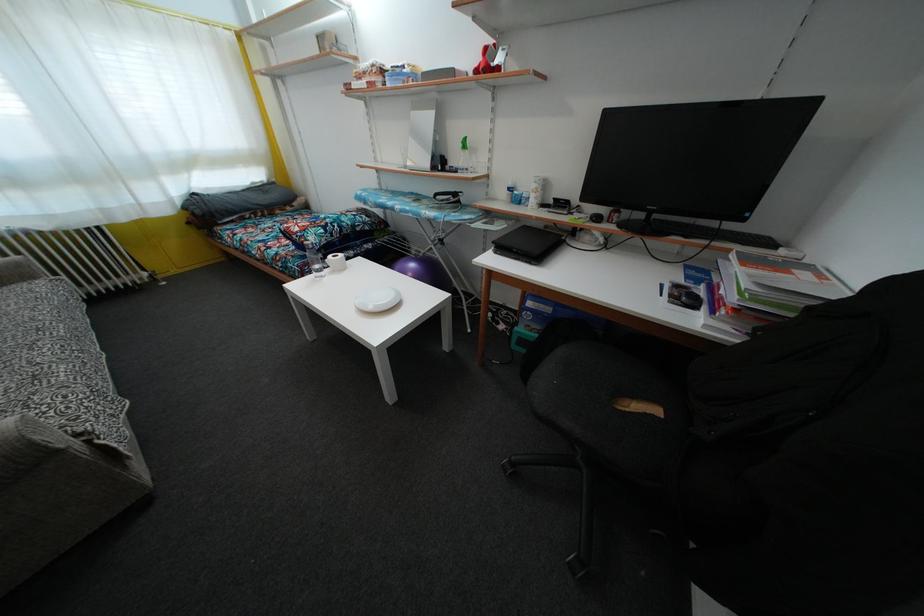
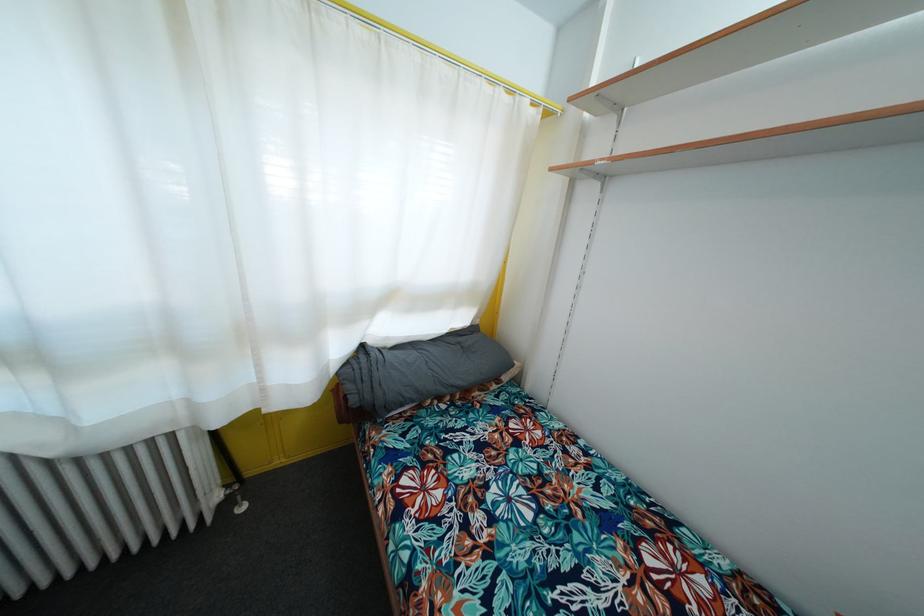
Where in the second image is the point corresponding to point (201, 219) from the first image?

(358, 407)